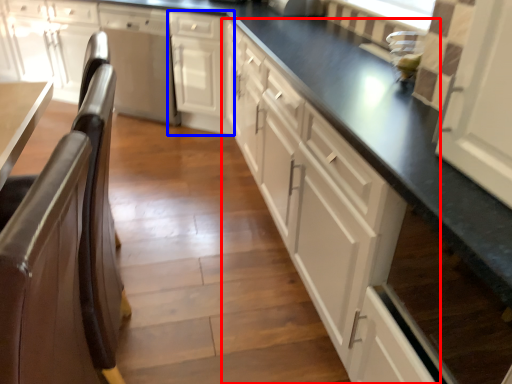
Question: Which of the following is the closest to the observer, cabinetry (highlighted by a red box) or cabinetry (highlighted by a blue box)?

Choices:
 (A) cabinetry
 (B) cabinetry

Answer: (A)